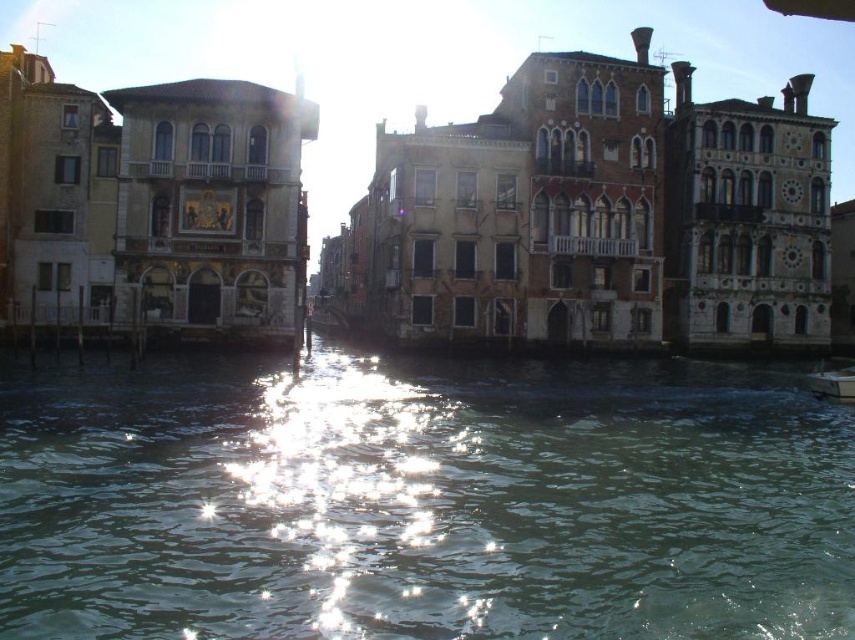
Question: Which point is farther from the camera taking this photo?

Choices:
 (A) (850, 378)
 (B) (340, 397)

Answer: (A)

Question: From the image, what is the correct spatial relationship of greenish water at center in relation to metallic silver boat at lower right?

Choices:
 (A) above
 (B) below

Answer: (B)

Question: Does greenish water at center appear on the right side of metallic silver boat at lower right?

Choices:
 (A) yes
 (B) no

Answer: (B)

Question: Which point is farther to the camera?

Choices:
 (A) (823, 376)
 (B) (0, 611)

Answer: (A)

Question: Does greenish water at center have a greater width compared to metallic silver boat at lower right?

Choices:
 (A) no
 (B) yes

Answer: (B)